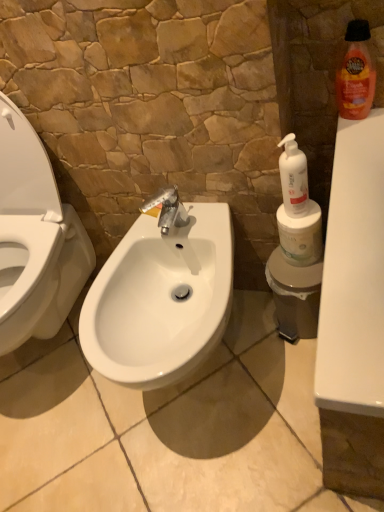
Question: From a real-world perspective, is white glossy sink at center physically located above or below white matte toilet paper at right?

Choices:
 (A) below
 (B) above

Answer: (A)

Question: From the image's perspective, is white glossy sink at center above or below white matte toilet paper at right?

Choices:
 (A) below
 (B) above

Answer: (A)

Question: Which object is the farthest from the white matte toilet paper at right?

Choices:
 (A) white glossy sink at center
 (B) white glossy bidet at center
 (C) orange glossy bottle at upper right, the 1th cleaning product when ordered from top to bottom
 (D) white plastic pump bottle at right, marked as the second cleaning product in a top-to-bottom arrangement

Answer: (B)

Question: Based on their relative distances, which object is nearer to the orange glossy bottle at upper right, placed as the second cleaning product when sorted from left to right?

Choices:
 (A) white matte toilet paper at right
 (B) white glossy bidet at center
 (C) white glossy sink at center
 (D) white plastic pump bottle at right, arranged as the second cleaning product when viewed from the right

Answer: (D)